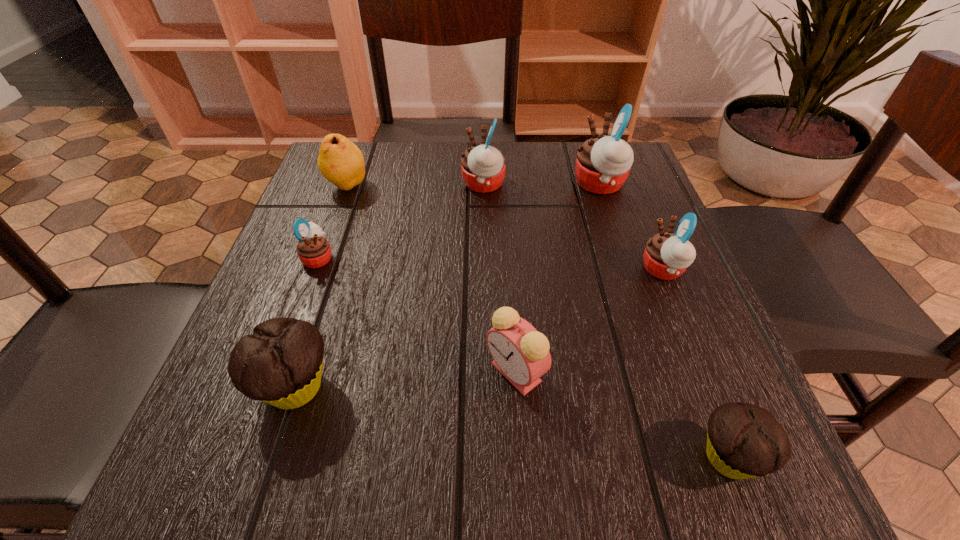
This screenshot has width=960, height=540. What are the coordinates of `object at the far right corner` in the screenshot? It's located at (603, 163).

You are a GUI agent. You are given a task and a screenshot of the screen. Output one action in this format:
    pyautogui.click(x=<x>, y=<y>)
    Task: Click on the object present at the near right corner
    The height and width of the screenshot is (540, 960).
    Given the screenshot: What is the action you would take?
    pyautogui.click(x=744, y=441)

In the image, there is a desktop. What are the coordinates of `vacant space at the far edge` in the screenshot? It's located at (395, 191).

Locate an element on the screen. vacant region at the near edge of the desktop is located at coordinates (540, 453).

The height and width of the screenshot is (540, 960). In order to click on vacant area at the left edge of the desktop in this screenshot , I will do `click(338, 250)`.

In the image, there is a desktop. At what (x,y) coordinates should I click in order to perform the action: click on vacant region at the right edge. Please return your answer as a coordinate pair (x, y). The width and height of the screenshot is (960, 540). Looking at the image, I should click on (684, 345).

At what (x,y) coordinates should I click in order to perform the action: click on blank area at the far left corner. Please return your answer as a coordinate pair (x, y). This screenshot has width=960, height=540. Looking at the image, I should click on (378, 153).

The image size is (960, 540). In the image, there is a desktop. What are the coordinates of `vacant space at the near left corner` in the screenshot? It's located at (304, 459).

Locate an element on the screen. The width and height of the screenshot is (960, 540). vacant space at the near right corner of the desktop is located at coordinates (675, 464).

Find the location of `free area in between the right chocolate muffin and the second smallest pink muffin`. free area in between the right chocolate muffin and the second smallest pink muffin is located at coordinates (696, 363).